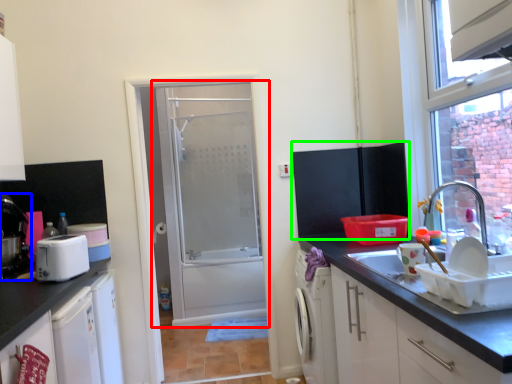
Question: Which object is positioned closest to door (highlighted by a red box)? Select from coffee machine (highlighted by a blue box) and wide (highlighted by a green box).

Choices:
 (A) coffee machine
 (B) wide

Answer: (B)